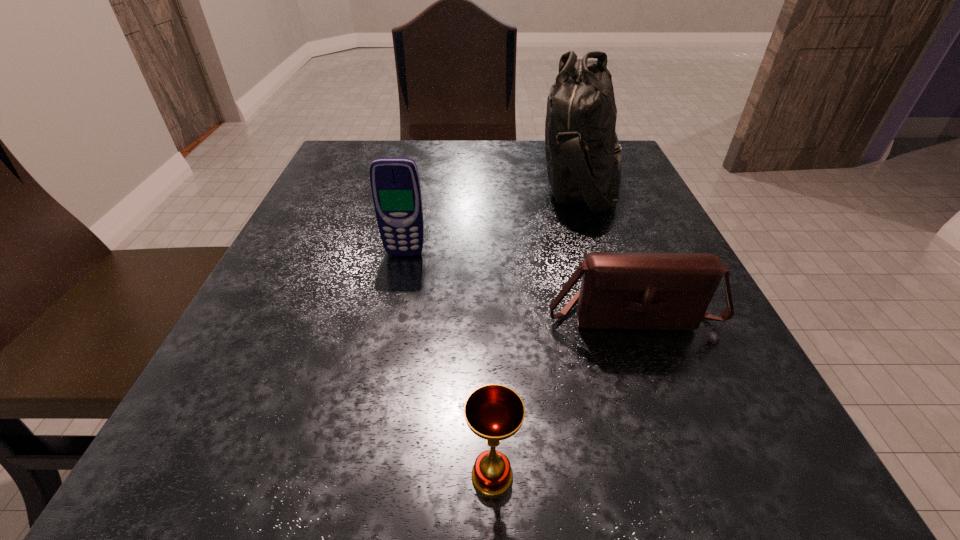
Where is `vacant space at the right edge`? This screenshot has width=960, height=540. vacant space at the right edge is located at coordinates (642, 238).

You are a GUI agent. You are given a task and a screenshot of the screen. Output one action in this format:
    pyautogui.click(x=<x>, y=<y>)
    Task: Click on the free space at the far left corner of the desktop
    Image resolution: width=960 pixels, height=540 pixels.
    Given the screenshot: What is the action you would take?
    pyautogui.click(x=313, y=188)

Identify the location of vacant space at the near left corner of the desktop. This screenshot has height=540, width=960. (294, 489).

At what (x,y) coordinates should I click in order to perform the action: click on free space at the near right corner. Please return your answer as a coordinate pair (x, y). Looking at the image, I should click on (724, 450).

Find the location of `vacant area between the farther shoulder bag and the second nearest object`. vacant area between the farther shoulder bag and the second nearest object is located at coordinates pos(608,247).

Where is `free area in between the nearer shoulder bag and the farthest object`? free area in between the nearer shoulder bag and the farthest object is located at coordinates [608, 247].

Where is `vacant space in between the second nearest object and the cellular telephone`? The image size is (960, 540). vacant space in between the second nearest object and the cellular telephone is located at coordinates (518, 284).

Locate an element on the screen. vacant area that lies between the shorter shoulder bag and the second object from left to right is located at coordinates pos(562,395).

Find the location of a particular element. This screenshot has width=960, height=540. free spot between the third nearest object and the farthest object is located at coordinates (494, 217).

You are a GUI agent. You are given a task and a screenshot of the screen. Output one action in this format:
    pyautogui.click(x=<x>, y=<y>)
    Task: Click on the free space between the cellular telephone and the chalice
    
    Given the screenshot: What is the action you would take?
    pyautogui.click(x=448, y=364)